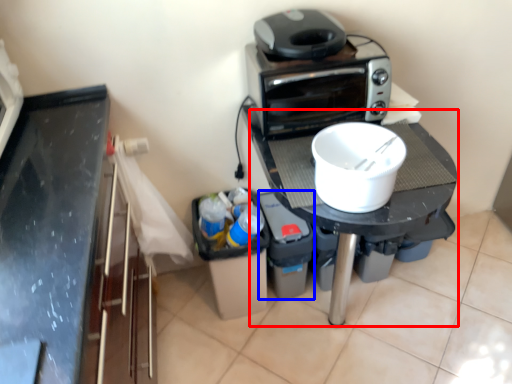
Question: Among these objects, which one is farthest to the camera, table (highlighted by a red box) or appliance (highlighted by a blue box)?

Choices:
 (A) table
 (B) appliance

Answer: (B)